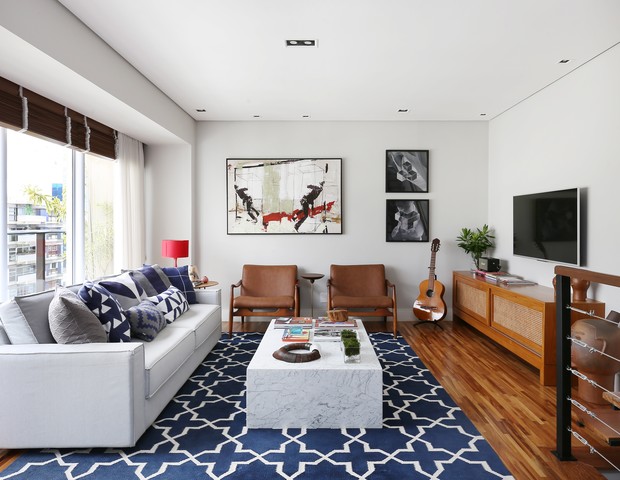
Where is `couch`? The height and width of the screenshot is (480, 620). couch is located at coordinates click(x=196, y=344).